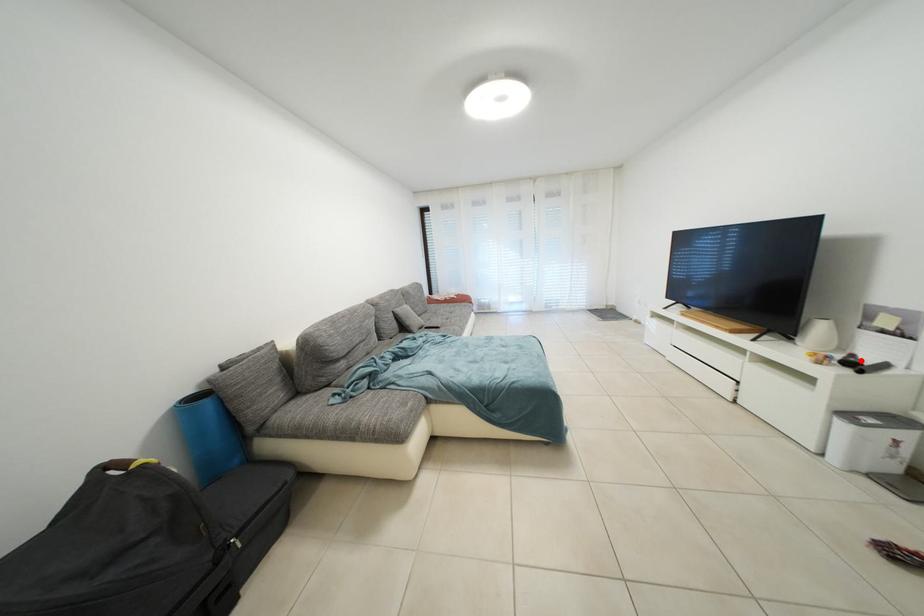
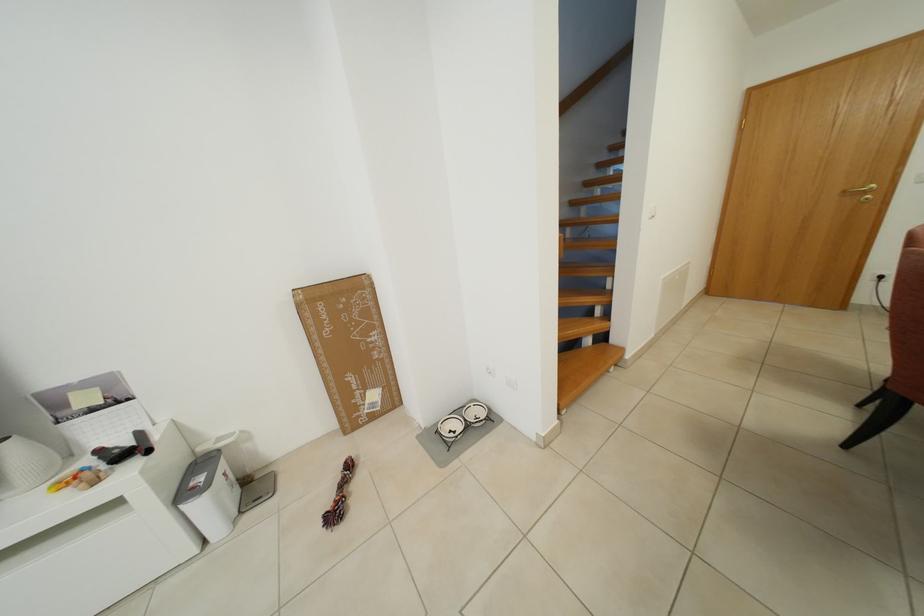
Where in the second image is the point corresponding to the highlighted location from the first image?

(108, 455)